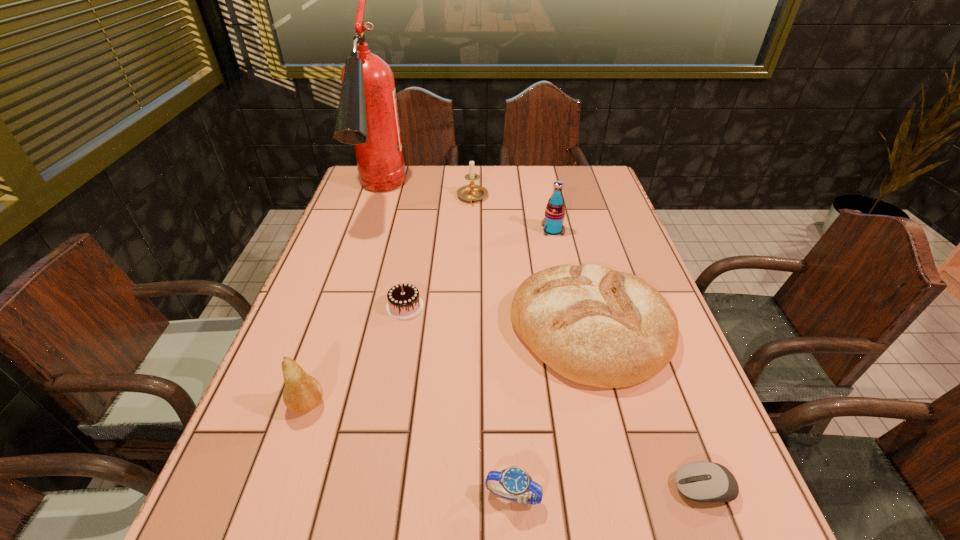
Identify which object is located as the nearest to the fire extinguisher. Please provide its 2D coordinates. Your answer should be formatted as a tuple, i.e. [(x, y)], where the tuple contains the x and y coordinates of a point satisfying the conditions above.

[(471, 192)]

Where is `the sixth closest object to the second shortest object`? The image size is (960, 540). the sixth closest object to the second shortest object is located at coordinates (367, 117).

This screenshot has height=540, width=960. I want to click on vacant space that satisfies the following two spatial constraints: 1. with a handle on the side of the candle holder; 2. on the left side of the fourth shortest object, so click(469, 329).

This screenshot has height=540, width=960. What are the coordinates of `free location that satisfies the following two spatial constraints: 1. with a handle on the side of the soda; 2. on the left side of the candle holder` in the screenshot? It's located at (471, 230).